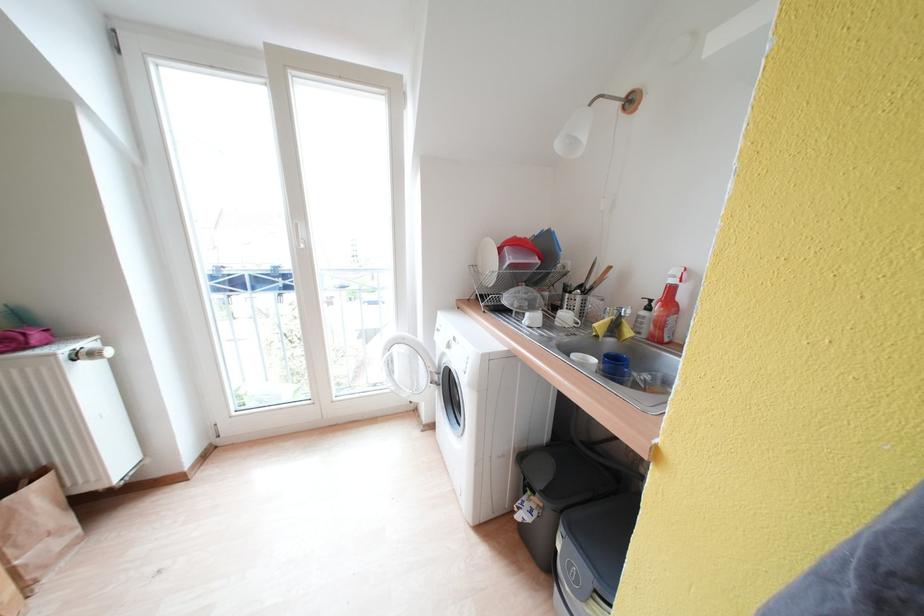
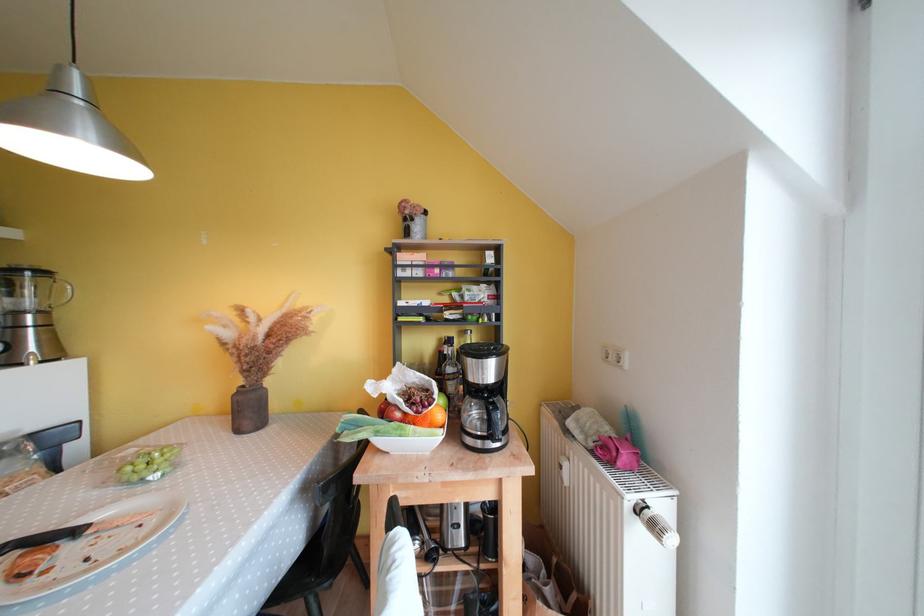
Question: Based on the continuous images, in which direction is the camera rotating? Reply with the corresponding letter.

Choices:
 (A) Left
 (B) Right
 (C) Up
 (D) Down

Answer: (A)